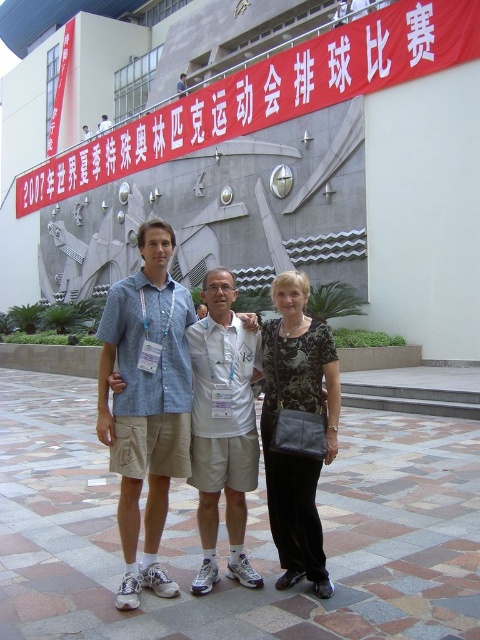
Question: Among these objects, which one is nearest to the camera?

Choices:
 (A) black textured dress at center
 (B) matte white shirt at center
 (C) white cotton shirt at center
 (D) light blue denim shorts at center

Answer: (D)

Question: Is black textured dress at center positioned behind white cotton shirt at center?

Choices:
 (A) yes
 (B) no

Answer: (B)

Question: Among these objects, which one is farthest from the camera?

Choices:
 (A) white paper banner at upper center
 (B) light blue denim shorts at center

Answer: (A)

Question: Does matte white shirt at center have a smaller size compared to black textured dress at center?

Choices:
 (A) no
 (B) yes

Answer: (B)

Question: Which object is the farthest from the matte white shirt at center?

Choices:
 (A) white cotton shirt at center
 (B) light blue denim shorts at center
 (C) white paper banner at upper center

Answer: (C)

Question: Is light blue denim shorts at center further to camera compared to white paper banner at upper center?

Choices:
 (A) yes
 (B) no

Answer: (B)